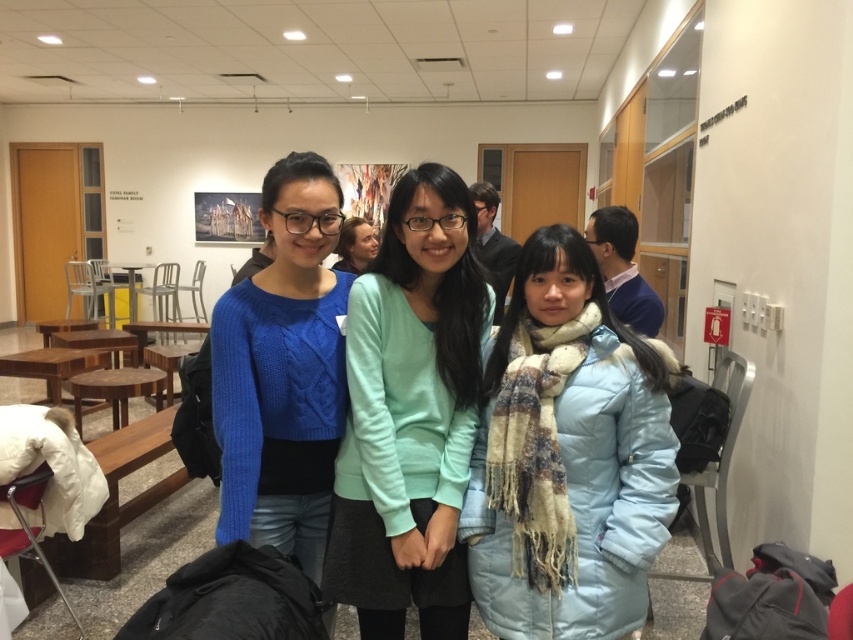
Question: Based on their relative distances, which object is nearer to the light blue down jacket at center?

Choices:
 (A) matte blue sweater at center
 (B) mint green sweater at center

Answer: (B)

Question: Can you confirm if mint green sweater at center is positioned below matte blue sweater at center?

Choices:
 (A) no
 (B) yes

Answer: (B)

Question: Based on their relative distances, which object is farther from the mint green sweater at center?

Choices:
 (A) matte blue sweater at center
 (B) light blue down jacket at center

Answer: (B)

Question: From the image, what is the correct spatial relationship of light blue down jacket at center in relation to mint green sweater at center?

Choices:
 (A) left
 (B) right

Answer: (B)

Question: Observing the image, what is the correct spatial positioning of light blue down jacket at center in reference to matte blue sweater at center?

Choices:
 (A) right
 (B) left

Answer: (A)

Question: Among these points, which one is nearest to the camera?

Choices:
 (A) (595, 516)
 (B) (328, 294)

Answer: (A)